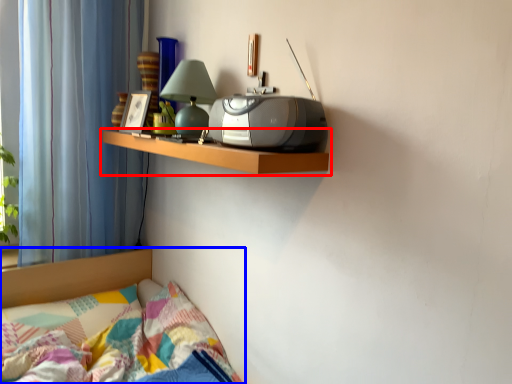
Question: Which of the following is the farthest to the observer, shelf (highlighted by a red box) or bed (highlighted by a blue box)?

Choices:
 (A) shelf
 (B) bed

Answer: (B)